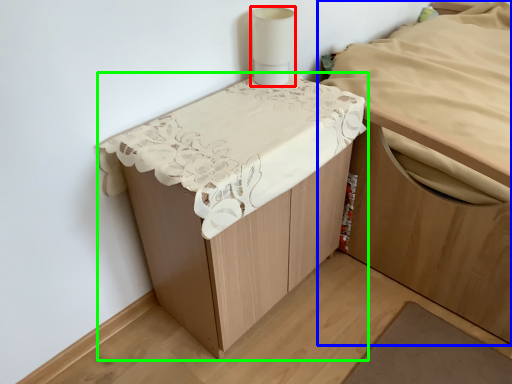
Question: Which object is positioned farthest from lamp (highlighted by a red box)? Select from furniture (highlighted by a blue box) and furniture (highlighted by a green box).

Choices:
 (A) furniture
 (B) furniture

Answer: (A)